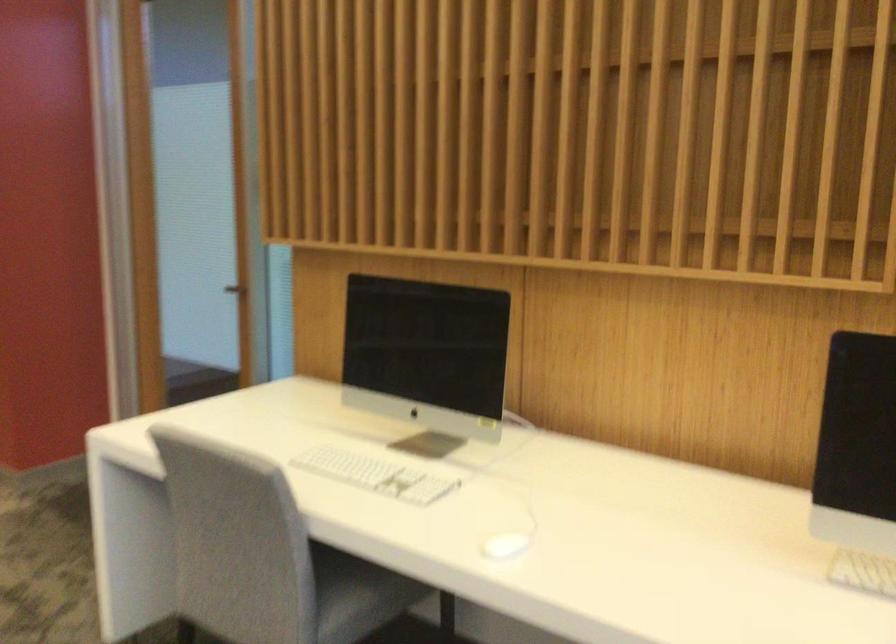
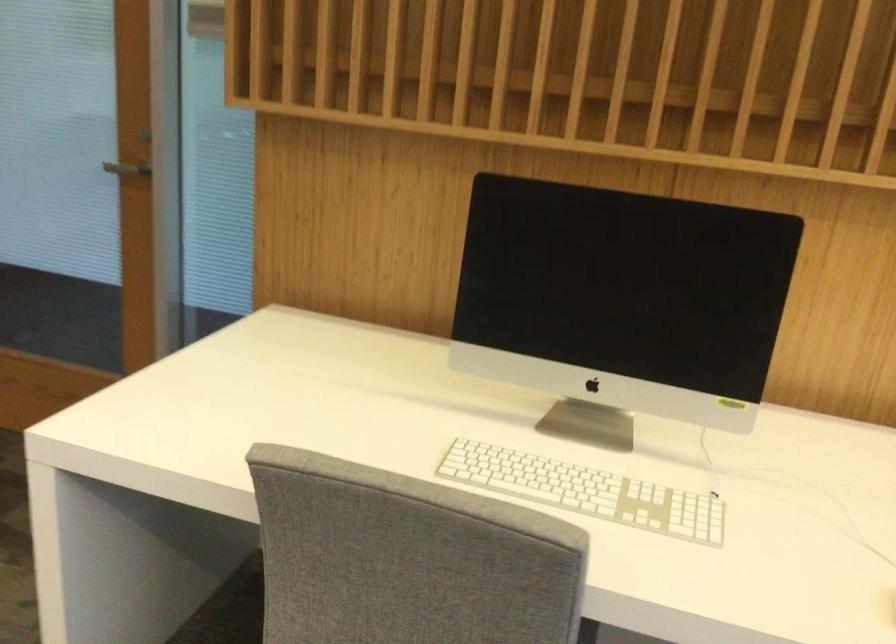
What movement of the cameraman would produce the second image?

The movement direction of the cameraman is left, forward.